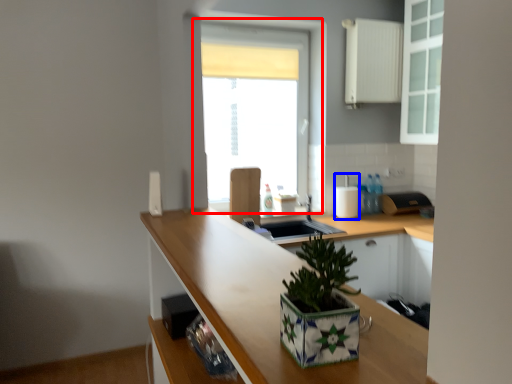
Question: Which point is closer to the camera, window (highlighted by a red box) or appliance (highlighted by a blue box)?

Choices:
 (A) window
 (B) appliance

Answer: (A)